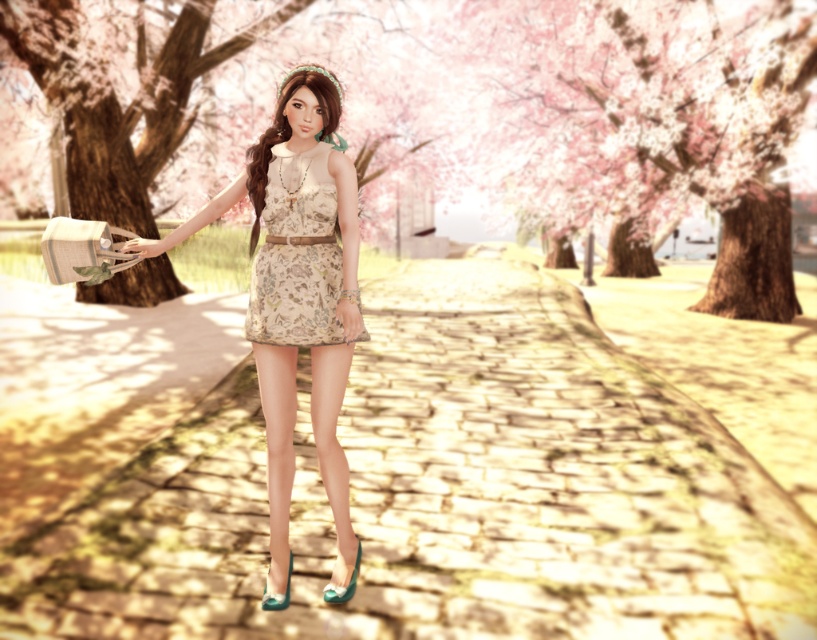
Question: Which object appears closest to the camera in this image?

Choices:
 (A) brown textured tree at center
 (B) yellow stone pavement at center
 (C) brown wood tree at center

Answer: (B)

Question: Which object is closer to the camera taking this photo?

Choices:
 (A) brown textured tree at center
 (B) floral fabric dress at center
 (C) yellow stone pavement at center
 (D) brown wood tree at center

Answer: (C)

Question: Which is nearer to the brown wood tree at center?

Choices:
 (A) matte floral dress at center
 (B) brown textured tree at center
 (C) yellow stone pavement at center
 (D) floral fabric dress at center

Answer: (B)

Question: Is yellow stone pavement at center wider than brown wood tree at center?

Choices:
 (A) no
 (B) yes

Answer: (A)

Question: From the image, what is the correct spatial relationship of yellow stone pavement at center in relation to brown wood tree at center?

Choices:
 (A) left
 (B) right

Answer: (B)

Question: Considering the relative positions of matte floral dress at center and brown textured tree at center in the image provided, where is matte floral dress at center located with respect to brown textured tree at center?

Choices:
 (A) left
 (B) right

Answer: (B)